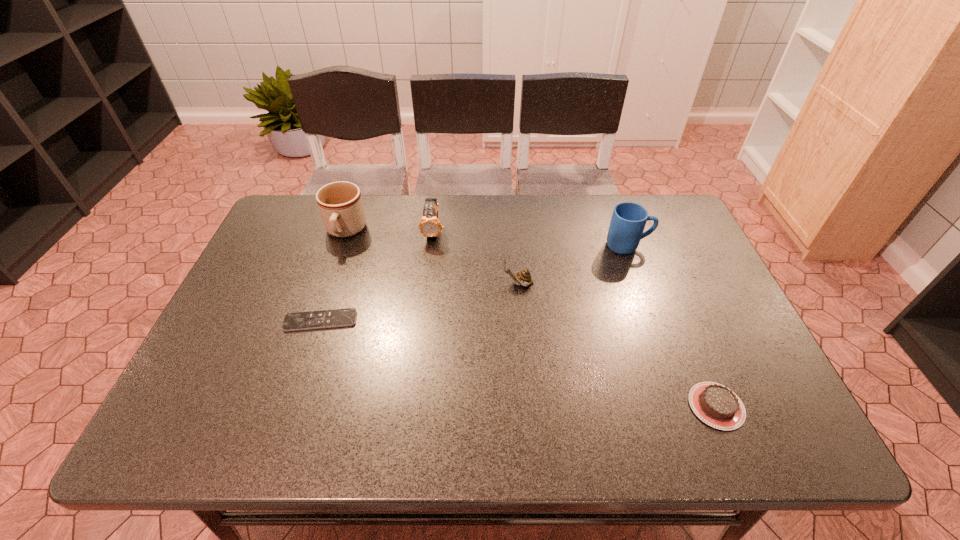
Locate an element on the screen. This screenshot has height=540, width=960. free space that is in between the right mug and the third object from left to right is located at coordinates (531, 239).

Locate an element on the screen. free space that is in between the watch and the fifth tallest object is located at coordinates (575, 319).

Where is `free space between the second shortest object and the fourth object from left to right`? free space between the second shortest object and the fourth object from left to right is located at coordinates (617, 345).

Locate an element on the screen. vacant space in between the fifth tallest object and the left mug is located at coordinates (531, 319).

Locate an element on the screen. This screenshot has height=540, width=960. vacant space that's between the fifth farthest object and the left mug is located at coordinates (333, 276).

You are a GUI agent. You are given a task and a screenshot of the screen. Output one action in this format:
    pyautogui.click(x=<x>, y=<y>)
    Task: Click on the vacant space that's between the second nearest object and the right mug
    Image resolution: width=960 pixels, height=540 pixels.
    Given the screenshot: What is the action you would take?
    pyautogui.click(x=474, y=284)

I want to click on vacant point located between the nearest object and the fourth object from right to left, so click(575, 319).

At what (x,y) coordinates should I click in order to perform the action: click on free space between the nearest object and the right mug. Please return your answer as a coordinate pair (x, y). Looking at the image, I should click on (672, 326).

Image resolution: width=960 pixels, height=540 pixels. What are the coordinates of `free space between the nearest object and the left mug` in the screenshot? It's located at (531, 319).

Identify the location of blank region between the left mug and the shortest object. (333, 276).